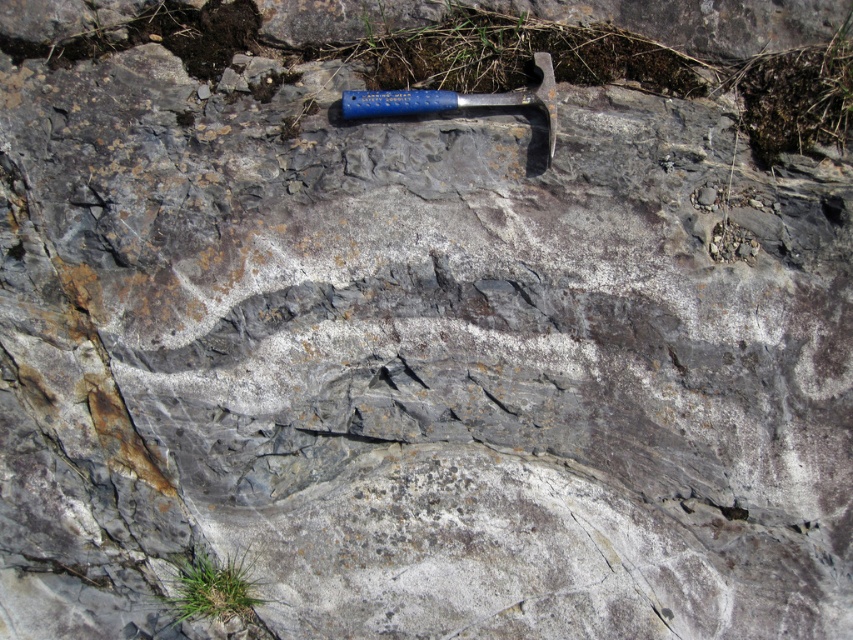
You are a geologist examining the rock surface. You notice a point marked at coordinates (491, 99). Based on the image, where is this point located?

The point at coordinates (491, 99) is located on the blue plastic hammer at center.

You are a geologist examining the rock surface. You see the blue plastic hammer at center and the blue metallic hammer at upper center. Which hammer is closer to you?

The blue plastic hammer at center is closer to you because it is in front of the blue metallic hammer at upper center.

You are a geologist examining the rock surface. You have two hammers, the blue plastic hammer at center and the blue metallic hammer at upper center. Which hammer is taller?

The blue plastic hammer at center is taller than the blue metallic hammer at upper center.